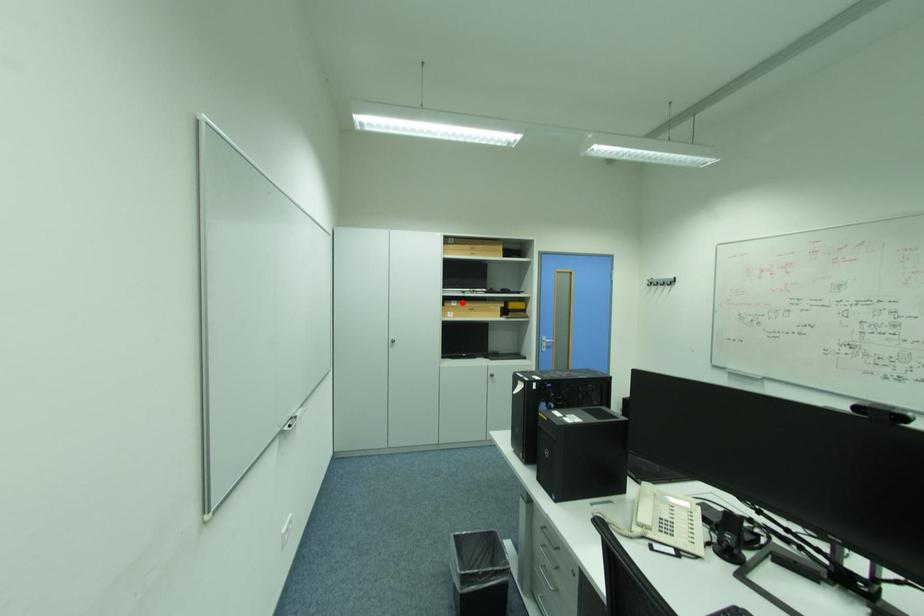
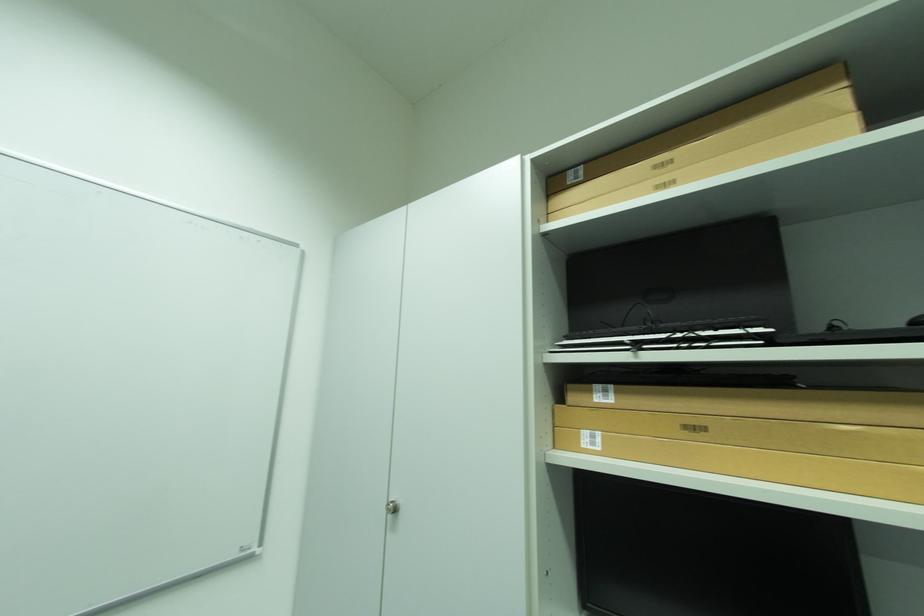
Locate, in the second image, the point that corresponds to the highlighted location in the first image.

(614, 392)